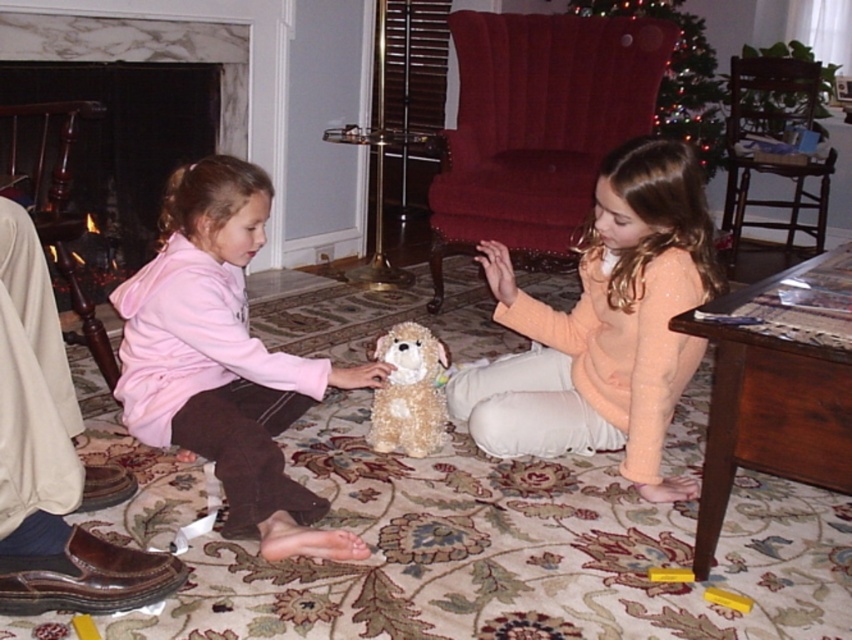
Question: Does matte peach sweater at center lie in front of wooden chair at right?

Choices:
 (A) no
 (B) yes

Answer: (B)

Question: Does matte peach sweater at center appear on the right side of pink fleece sweater at lower left?

Choices:
 (A) yes
 (B) no

Answer: (A)

Question: Which point appears closest to the camera in this image?

Choices:
 (A) (320, 556)
 (B) (398, 355)

Answer: (A)

Question: Which object is positioned farthest from the wooden armchair at left?

Choices:
 (A) pink fleece sweater at lower left
 (B) velvet red armchair at center
 (C) fuzzy beige teddy bear at center

Answer: (B)

Question: Where is pink fleece sweater at lower left located in relation to shiny green christmas tree at upper center in the image?

Choices:
 (A) left
 (B) right

Answer: (A)

Question: Which of these objects is positioned farthest from the velvet red armchair at center?

Choices:
 (A) wooden chair at right
 (B) pink fleece sweater at lower left
 (C) fuzzy beige teddy bear at center
 (D) shiny green christmas tree at upper center

Answer: (B)